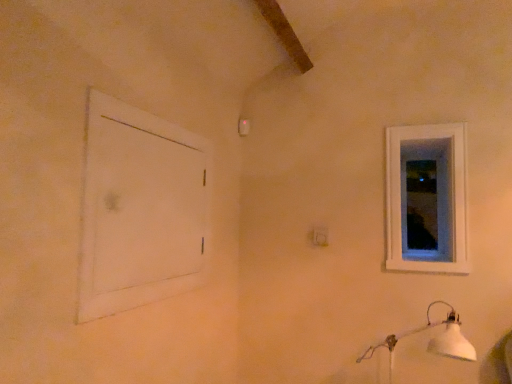
Question: From a real-world perspective, does white matte lamp at lower right sit lower than white wooden window at upper right?

Choices:
 (A) yes
 (B) no

Answer: (A)

Question: Is white matte lamp at lower right positioned before white wooden window at upper right?

Choices:
 (A) yes
 (B) no

Answer: (A)

Question: Does white matte lamp at lower right appear on the right side of white wooden window at upper right?

Choices:
 (A) no
 (B) yes

Answer: (A)

Question: Is white matte lamp at lower right oriented away from white wooden window at upper right?

Choices:
 (A) yes
 (B) no

Answer: (B)

Question: Would you say white wooden window at upper right is part of white matte lamp at lower right's contents?

Choices:
 (A) yes
 (B) no

Answer: (B)

Question: Visually, is white matte door at left positioned to the left or to the right of transparent glass window at upper right?

Choices:
 (A) left
 (B) right

Answer: (A)

Question: In terms of width, does white matte door at left look wider or thinner when compared to transparent glass window at upper right?

Choices:
 (A) wide
 (B) thin

Answer: (A)

Question: In the image, is white matte door at left positioned in front of or behind transparent glass window at upper right?

Choices:
 (A) behind
 (B) front

Answer: (B)

Question: Which is correct: white matte door at left is inside transparent glass window at upper right, or outside of it?

Choices:
 (A) inside
 (B) outside

Answer: (B)

Question: Is white plastic electric outlet at center spatially inside white wooden window at upper right, or outside of it?

Choices:
 (A) outside
 (B) inside

Answer: (A)

Question: Is point (320, 233) closer or farther from the camera than point (397, 132)?

Choices:
 (A) closer
 (B) farther

Answer: (B)

Question: From a real-world perspective, is white plastic electric outlet at center above or below white wooden window at upper right?

Choices:
 (A) above
 (B) below

Answer: (B)

Question: Is white plastic electric outlet at center wider or thinner than white wooden window at upper right?

Choices:
 (A) thin
 (B) wide

Answer: (B)

Question: Is transparent glass window at upper right spatially inside white plastic electric outlet at center, or outside of it?

Choices:
 (A) inside
 (B) outside

Answer: (B)

Question: Considering the positions of transparent glass window at upper right and white plastic electric outlet at center in the image, is transparent glass window at upper right wider or thinner than white plastic electric outlet at center?

Choices:
 (A) thin
 (B) wide

Answer: (B)